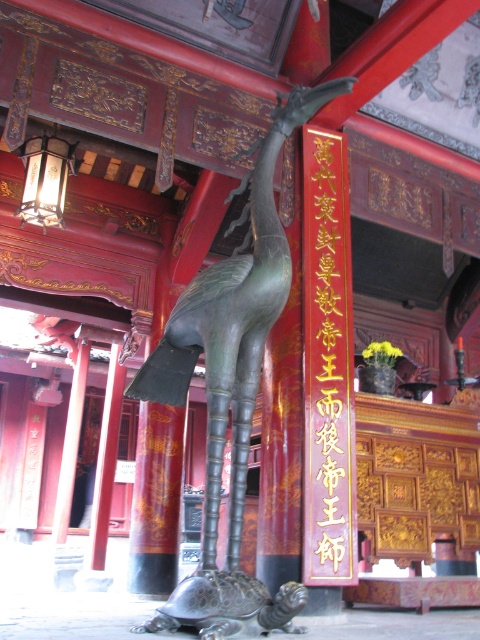
You are a visitor standing in the temple and want to read the red wood sign at center. The bronze statue at center is blocking your view. Which direction should you move to see the sign clearly?

The bronze statue at center is to the left of the red wood sign at center. To see the sign clearly, you should move to the right side of the bronze statue at center so that the statue no longer blocks your view.

You are an interior designer planning to place a new decorative item in the space between the bronze statue at center and the red wood sign at center. To ensure proper spacing, you need to know which object is wider. Can you determine which one is wider?

The bronze statue at center might be wider than red wood sign at center, so it is possible that the bronze statue at center requires more space. You should consider this when placing the new decorative item.